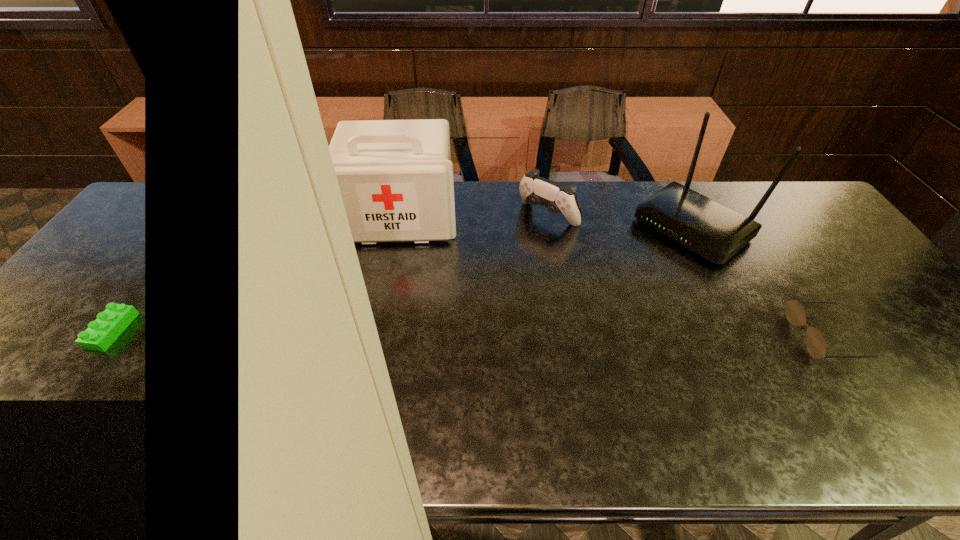
Where is `router positioned at the far edge`? This screenshot has width=960, height=540. router positioned at the far edge is located at coordinates (715, 232).

Where is `blank space at the far edge of the desktop`? Image resolution: width=960 pixels, height=540 pixels. blank space at the far edge of the desktop is located at coordinates (321, 211).

This screenshot has width=960, height=540. Find the location of `vacant area at the left edge of the desktop`. vacant area at the left edge of the desktop is located at coordinates (149, 237).

In order to click on vacant area at the right edge of the desktop in this screenshot , I will do `click(809, 244)`.

Find the location of a particular element. The image size is (960, 540). blank area at the far right corner is located at coordinates (789, 223).

You are a GUI agent. You are given a task and a screenshot of the screen. Output one action in this format:
    pyautogui.click(x=<x>, y=<y>)
    Task: Click on the free space between the router and the shortest object
    
    Given the screenshot: What is the action you would take?
    pyautogui.click(x=758, y=282)

Where is `free space between the router and the second shortest object`? free space between the router and the second shortest object is located at coordinates [x=621, y=222].

This screenshot has width=960, height=540. In order to click on free spot between the sunglasses and the first-aid kit in this screenshot , I will do `click(612, 276)`.

Where is `free spot between the second shortest object and the router`? The height and width of the screenshot is (540, 960). free spot between the second shortest object and the router is located at coordinates (621, 222).

Locate an element on the screen. This screenshot has height=540, width=960. free point between the control and the router is located at coordinates (621, 222).